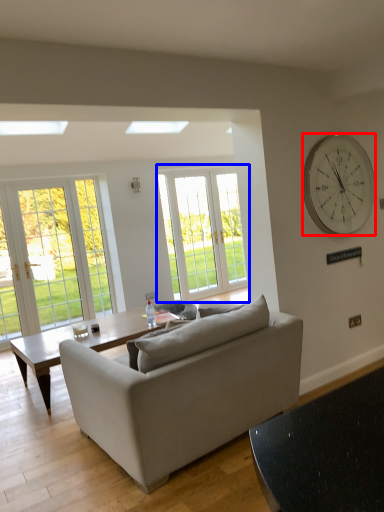
Question: Which point is further to the camera, wall clock (highlighted by a red box) or window (highlighted by a blue box)?

Choices:
 (A) wall clock
 (B) window

Answer: (B)